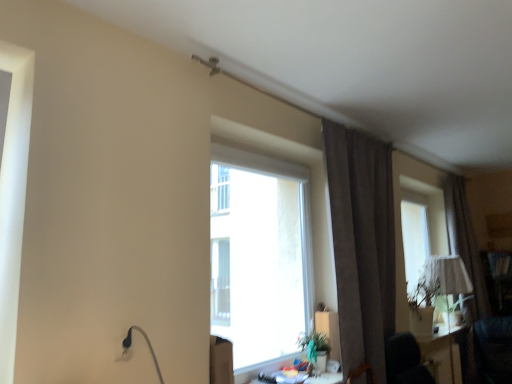
Question: Which is correct: wooden desk at lower center, the first table when ordered from left to right, is inside brown fabric curtain at right, which is counted as the 2th curtain, starting from the front, or outside of it?

Choices:
 (A) outside
 (B) inside

Answer: (A)

Question: From a real-world perspective, is wooden desk at lower center, the first table when ordered from left to right, above or below brown fabric curtain at right, the 1th curtain viewed from the right?

Choices:
 (A) below
 (B) above

Answer: (A)

Question: Which is farther from the matte white lampshade at right?

Choices:
 (A) wooden desk at lower center, which is the first table in top-to-bottom order
 (B) brown fabric curtain at right, which is counted as the 2th curtain, starting from the front
 (C) brown velvet curtain at upper right, which is the 1th curtain from front to back
 (D) transparent glass window at center
 (E) matte white table at lower right, arranged as the first table when viewed from the back

Answer: (A)

Question: Which object is the closest to the brown velvet curtain at upper right, which appears as the first curtain when viewed from the left?

Choices:
 (A) matte white lampshade at right
 (B) wooden desk at lower center, the second table positioned from the bottom
 (C) matte white table at lower right, placed as the first table when sorted from bottom to top
 (D) brown fabric curtain at right, the first curtain when ordered from back to front
 (E) transparent glass window at center

Answer: (E)